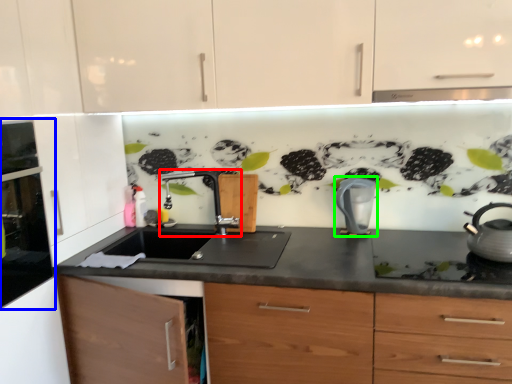
Question: Which is farther away from tap (highlighted by a red box)? home appliance (highlighted by a blue box) or kitchen appliance (highlighted by a green box)?

Choices:
 (A) home appliance
 (B) kitchen appliance

Answer: (A)